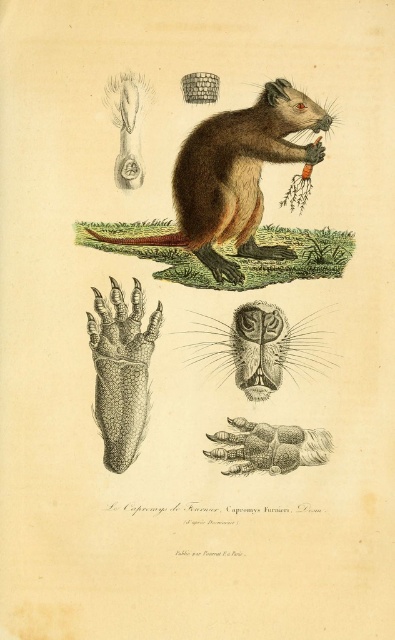
Based on the botanical illustration of the Capromys Furnieri, can you determine the spatial relationship between the smooth brown nose at center and the smooth brown paw at center?

The smooth brown nose at center is above the smooth brown paw at center.

You are an artist examining the botanical illustration of the Cuban tree rat. You notice the brown furry beaver at center and the smooth brown paw at center. Which object in the image is bigger?

The brown furry beaver at center is larger in size compared to the smooth brown paw at center.

Looking at the botanical illustration of the Capromys Furnieri, you notice the brown furry beaver at center and the smooth brown nose at center. Which of these two features is larger in size?

The brown furry beaver at center is bigger than the smooth brown nose at center.